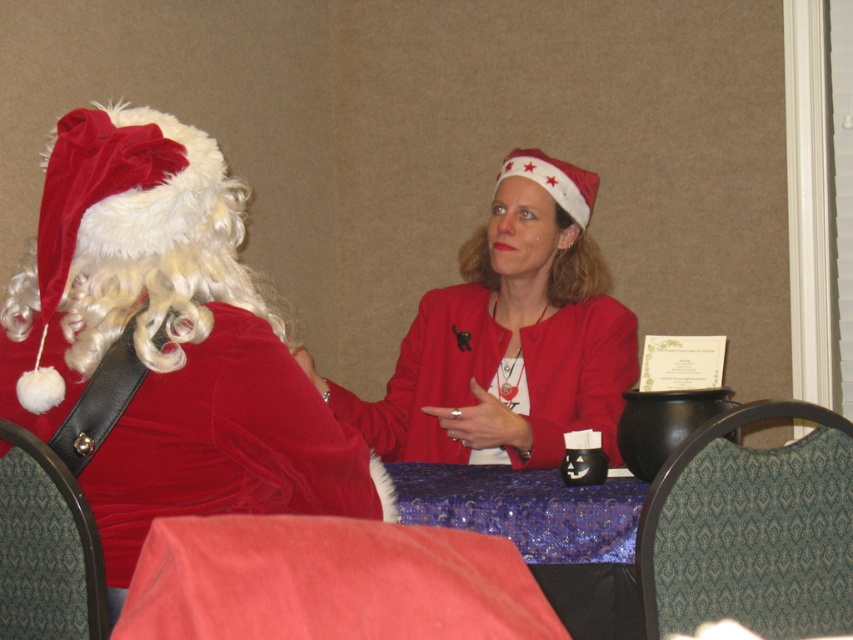
Question: Can you confirm if green fabric chair at lower right is wider than purple fabric table at center?

Choices:
 (A) no
 (B) yes

Answer: (A)

Question: Which object appears closest to the camera in this image?

Choices:
 (A) matte red jacket at center
 (B) green fabric chair at lower right

Answer: (B)

Question: Can you confirm if velvet santa claus at left is positioned above velvet red chair at lower left?

Choices:
 (A) no
 (B) yes

Answer: (B)

Question: Which object appears closest to the camera in this image?

Choices:
 (A) velvet red chair at lower left
 (B) velvet santa claus at left
 (C) purple fabric table at center
 (D) green fabric chair at lower right

Answer: (A)

Question: Does velvet santa claus at left appear over matte red jacket at center?

Choices:
 (A) yes
 (B) no

Answer: (B)

Question: Which point is farther from the camera taking this photo?

Choices:
 (A) (3, 554)
 (B) (526, 496)

Answer: (B)